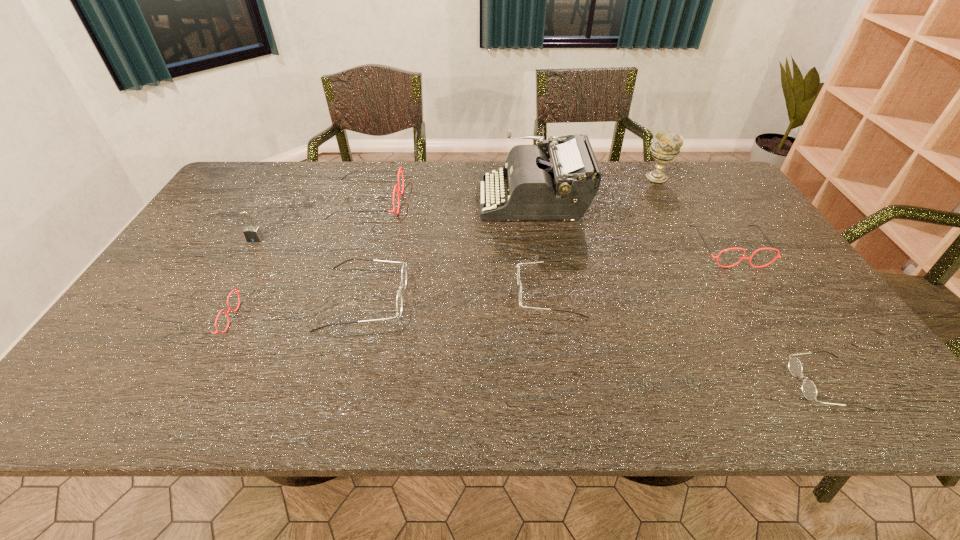
Locate an element on the screen. Image resolution: width=960 pixels, height=540 pixels. free space between the padlock and the nearest object is located at coordinates (540, 312).

Where is `free space between the leftmost dark spectacles and the fourth spectacles from left to right`? This screenshot has height=540, width=960. free space between the leftmost dark spectacles and the fourth spectacles from left to right is located at coordinates (457, 296).

Where is `vacant point located between the white chalice and the shortest spectacles`? Image resolution: width=960 pixels, height=540 pixels. vacant point located between the white chalice and the shortest spectacles is located at coordinates pyautogui.click(x=741, y=280).

I want to click on unoccupied position between the shortest object and the smallest red spectacles, so click(516, 351).

Locate an element on the screen. The width and height of the screenshot is (960, 540). unoccupied position between the second smallest red spectacles and the typewriter is located at coordinates (631, 223).

Locate an element on the screen. vacant area that lies between the second tallest object and the second dark spectacles from right to left is located at coordinates (603, 235).

At what (x,y) coordinates should I click in order to perform the action: click on empty space that is in between the leftmost dark spectacles and the fifth nearest spectacles. Please return your answer as a coordinate pair (x, y). The image size is (960, 540). Looking at the image, I should click on (546, 273).

Identify the location of free space between the nearest red spectacles and the tallest object. point(370,259).

I want to click on vacant space that's between the nearest red spectacles and the shortest object, so click(x=516, y=351).

The image size is (960, 540). I want to click on object that is the third closest to the typewriter, so click(404, 272).